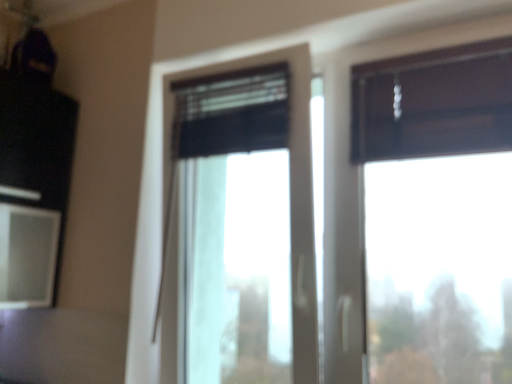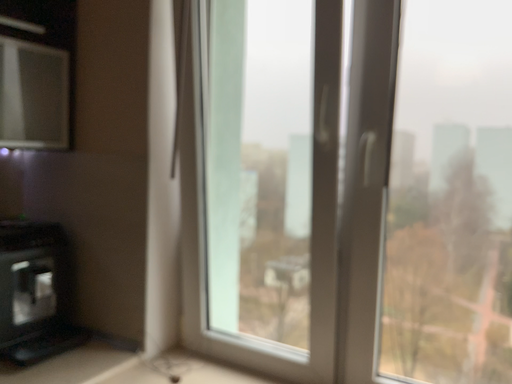
Question: How did the camera likely rotate when shooting the video?

Choices:
 (A) rotated downward
 (B) rotated upward

Answer: (A)